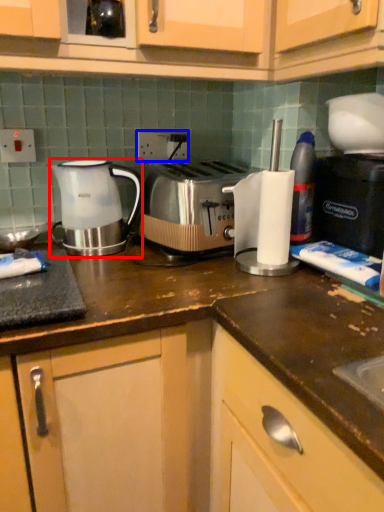
Question: Among these objects, which one is nearest to the camera, kettle (highlighted by a red box) or electric outlet (highlighted by a blue box)?

Choices:
 (A) kettle
 (B) electric outlet

Answer: (A)